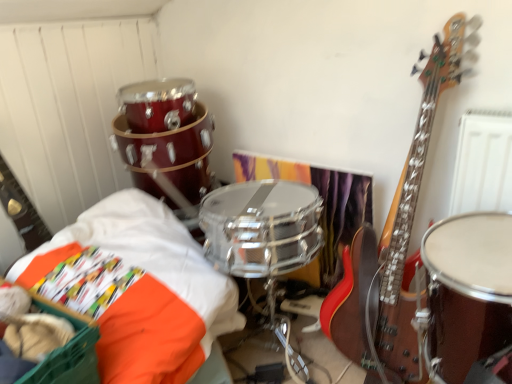
Question: Does shiny brown drum at right have a greater width compared to orange fabric basket at lower left?

Choices:
 (A) yes
 (B) no

Answer: (B)

Question: From the image's perspective, is shiny brown drum at right below orange fabric basket at lower left?

Choices:
 (A) no
 (B) yes

Answer: (A)

Question: From the image's perspective, does shiny brown drum at right appear higher than orange fabric basket at lower left?

Choices:
 (A) yes
 (B) no

Answer: (A)

Question: Considering the relative sizes of shiny brown drum at right and orange fabric basket at lower left in the image provided, is shiny brown drum at right shorter than orange fabric basket at lower left?

Choices:
 (A) no
 (B) yes

Answer: (A)

Question: Can you confirm if shiny brown drum at right is thinner than orange fabric basket at lower left?

Choices:
 (A) no
 (B) yes

Answer: (B)

Question: Are shiny brown drum at right and orange fabric basket at lower left located far from each other?

Choices:
 (A) no
 (B) yes

Answer: (A)

Question: From a real-world perspective, is orange fabric at lower left physically above orange fabric basket at lower left?

Choices:
 (A) yes
 (B) no

Answer: (B)

Question: Is orange fabric at lower left outside orange fabric basket at lower left?

Choices:
 (A) no
 (B) yes

Answer: (B)

Question: Is orange fabric at lower left far from orange fabric basket at lower left?

Choices:
 (A) yes
 (B) no

Answer: (B)

Question: Does orange fabric at lower left have a greater width compared to orange fabric basket at lower left?

Choices:
 (A) no
 (B) yes

Answer: (B)

Question: Considering the relative sizes of orange fabric at lower left and orange fabric basket at lower left in the image provided, is orange fabric at lower left smaller than orange fabric basket at lower left?

Choices:
 (A) yes
 (B) no

Answer: (B)

Question: Considering the relative sizes of orange fabric at lower left and orange fabric basket at lower left in the image provided, is orange fabric at lower left taller than orange fabric basket at lower left?

Choices:
 (A) yes
 (B) no

Answer: (A)

Question: Can you confirm if orange fabric basket at lower left is wider than orange fabric at lower left?

Choices:
 (A) yes
 (B) no

Answer: (B)